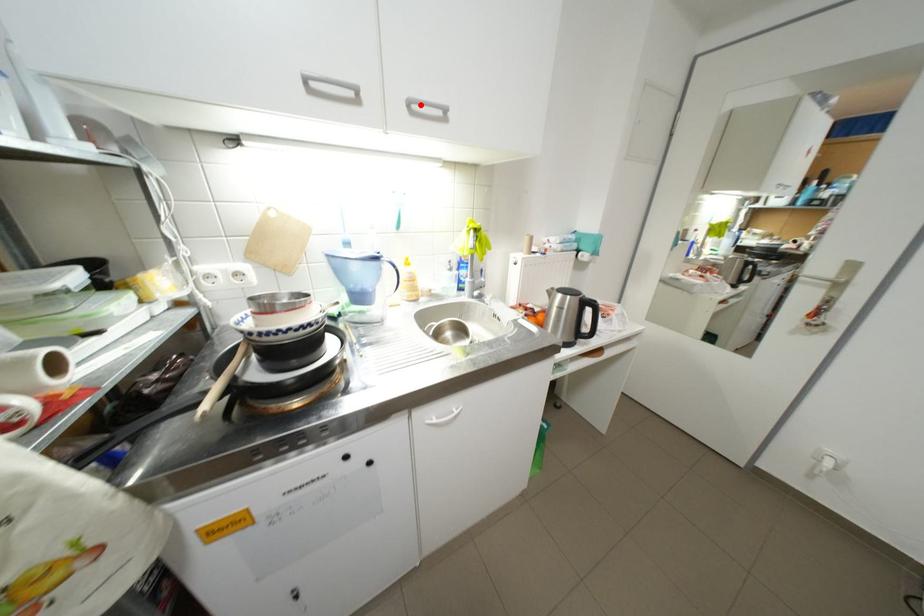
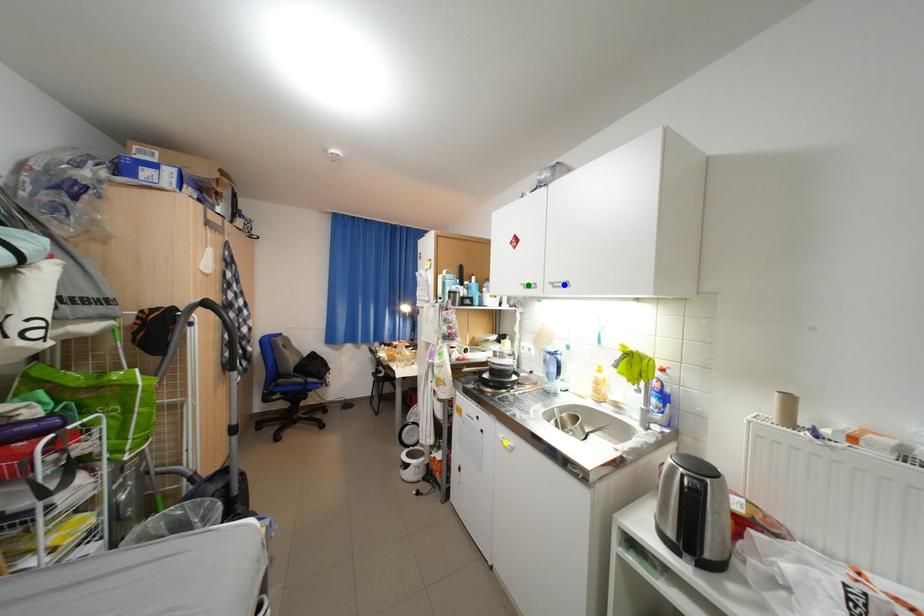
Question: I am providing you with two images of the same scene from different viewpoints. A red point is marked on the first image. You are given multiple points on the second image. Which point in image 2 represents the same 3d spot as the red point in image 1?

Choices:
 (A) green point
 (B) yellow point
 (C) blue point

Answer: (C)